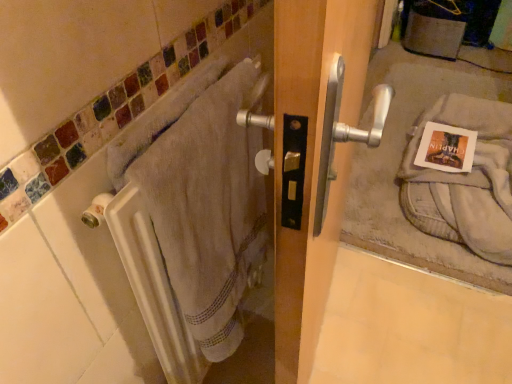
Question: From their relative heights in the image, would you say matte paper postcard at door handle is taller or shorter than white towel at left?

Choices:
 (A) tall
 (B) short

Answer: (B)

Question: Considering the positions of matte paper postcard at door handle and white towel at left in the image, is matte paper postcard at door handle wider or thinner than white towel at left?

Choices:
 (A) thin
 (B) wide

Answer: (B)

Question: Which is nearer to the matte paper postcard at door handle?

Choices:
 (A) white towel at left
 (B) gray cotton towel at lower right, placed as the 2th bath towel when sorted from left to right
 (C) beige cotton towel at left, marked as the second bath towel in a back-to-front arrangement

Answer: (B)

Question: Estimate the real-world distances between objects in this image. Which object is farther from the white towel at left?

Choices:
 (A) matte paper postcard at door handle
 (B) beige cotton towel at left, arranged as the first bath towel when viewed from the left
 (C) gray cotton towel at lower right, placed as the 2th bath towel when sorted from left to right

Answer: (A)